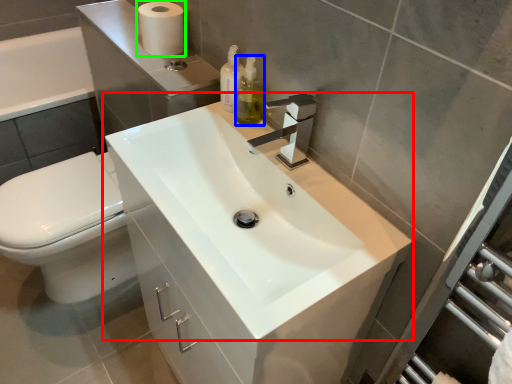
Question: Which is nearer to the sink (highlighted by a red box)? soap dispenser (highlighted by a blue box) or toilet paper (highlighted by a green box).

Choices:
 (A) soap dispenser
 (B) toilet paper

Answer: (A)